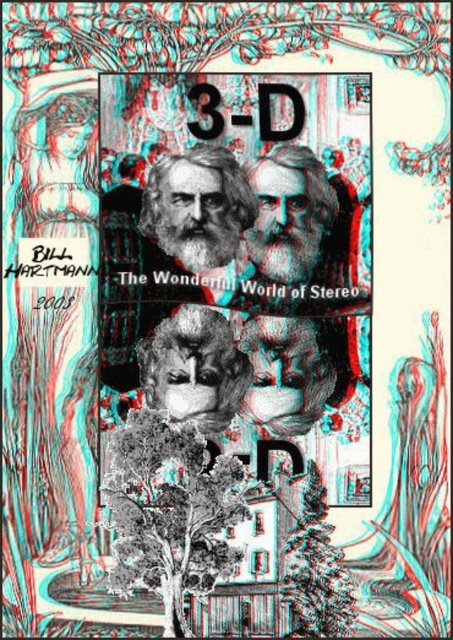
You are a photographer who needs to capture a closeup of the white beard at center for a 3D effect. Given that the ideal distance for a 3D portrait is between 1.0 to 1.5 meters, is the current distance suitable?

The distance of white beard at center from camera is 1.23 meters, which falls within the ideal range of 1.0 to 1.5 meters. Therefore, the current distance is suitable for capturing a 3D portrait.

You are an artist analyzing the image. The scene has a green leafy tree at lower center and a white beard at center. Which object takes up more space in the image?

The green leafy tree at lower center takes up more space in the image because it has a larger size compared to the white beard at center.

You are an art curator planning to display the white beard at center and the green matte tree at lower center in a gallery. Which object should you allocate more horizontal space to based on their widths?

The white beard at center might be wider than green matte tree at lower center, so you should allocate more horizontal space to the white beard at center.